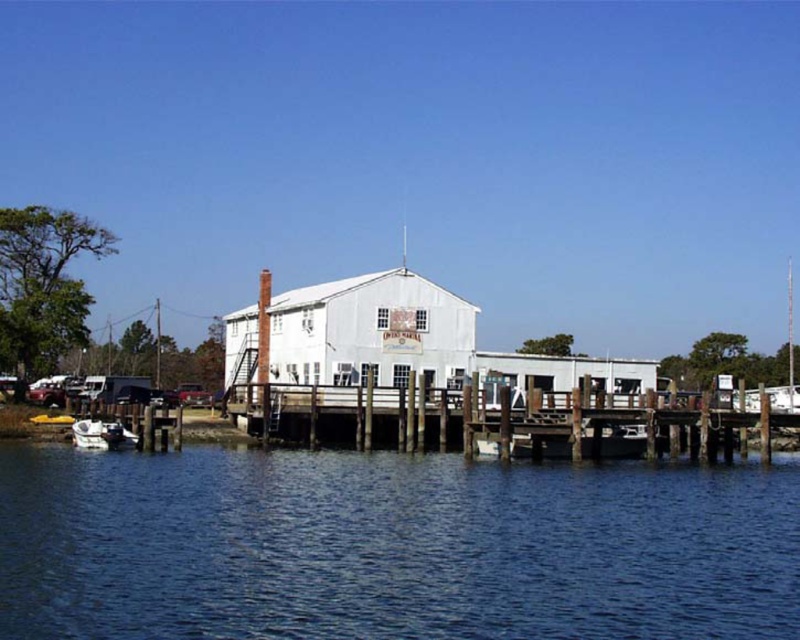
Question: Can you confirm if wooden at center is positioned below metallic red car at lower left?

Choices:
 (A) yes
 (B) no

Answer: (B)

Question: Does blue liquid water at lower center have a greater width compared to white matte boat at lower left?

Choices:
 (A) no
 (B) yes

Answer: (B)

Question: Which of the following is the closest to the observer?

Choices:
 (A) (562, 484)
 (B) (184, 388)
 (C) (72, 438)
 (D) (533, 394)

Answer: (A)

Question: Among these points, which one is nearest to the camera?

Choices:
 (A) (73, 422)
 (B) (420, 625)

Answer: (B)

Question: Does white matte boat at lower left appear over metallic red car at lower left?

Choices:
 (A) yes
 (B) no

Answer: (B)

Question: Which object appears farthest from the camera in this image?

Choices:
 (A) blue liquid water at lower center
 (B) white matte boat at lower left
 (C) wooden at center
 (D) metallic red car at lower left

Answer: (D)